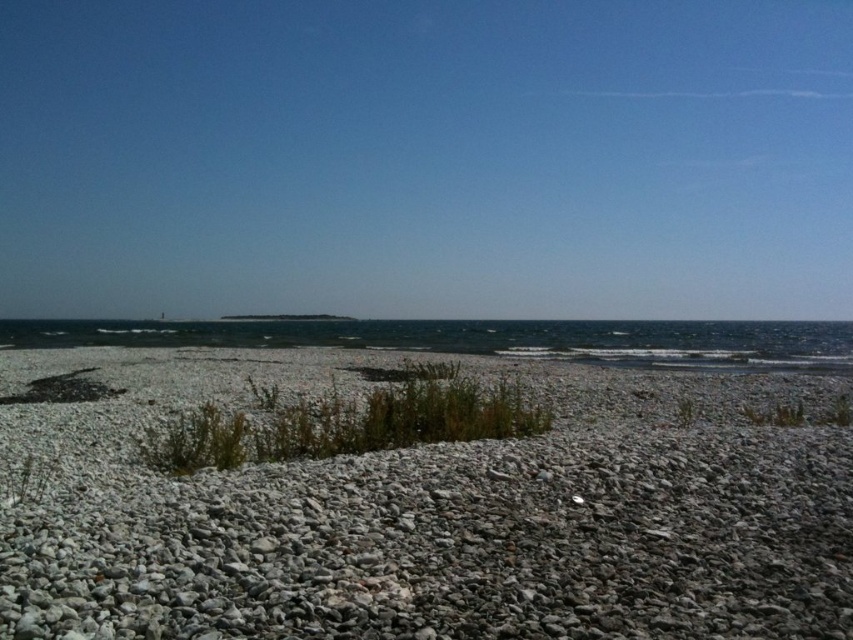
Can you confirm if gray gravel at center is smaller than clear blue water at center?

Yes.

Is gray gravel at center below clear blue water at center?

Yes.

Locate an element on the screen. This screenshot has height=640, width=853. gray gravel at center is located at coordinates click(432, 513).